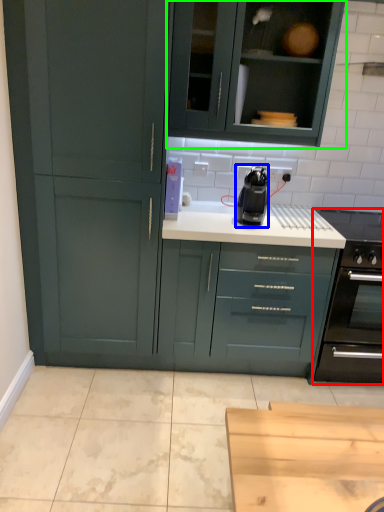
Question: Estimate the real-world distances between objects in this image. Which object is closer to home appliance (highlighted by a red box), kitchen appliance (highlighted by a blue box) or cabinetry (highlighted by a green box)?

Choices:
 (A) kitchen appliance
 (B) cabinetry

Answer: (A)